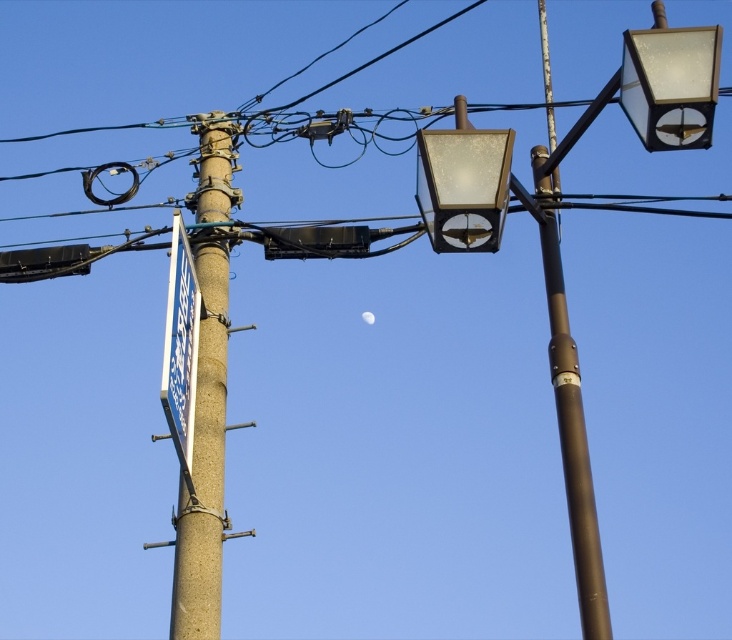
You are a photographer trying to capture both the matte brown street light at upper right and the matte glass streetlight at upper center in a single shot. Which one of these two objects will appear larger in your photo?

The matte brown street light at upper right is closer to the viewer than the matte glass streetlight at upper center, so it will appear larger in the photo.

You are a photographer standing in front of the scene. You want to take a photo that includes both the brown metallic pole at upper right and the matte glass streetlight at upper center. Which object should you position closer to the edge of the frame to ensure both are fully visible?

You should position the matte glass streetlight at upper center closer to the edge of the frame because the brown metallic pole at upper right is closer to the viewer. By moving the matte glass streetlight at upper center towards the edge, you can ensure both objects are fully captured within the frame.

You are a city planner analyzing the layout of this street. You notice the concrete textured telegraph pole at left and the translucent glass streetlight at upper right. Which object occupies more space in the scene?

The concrete textured telegraph pole at left has a larger size compared to the translucent glass streetlight at upper right, so it occupies more space in the scene.